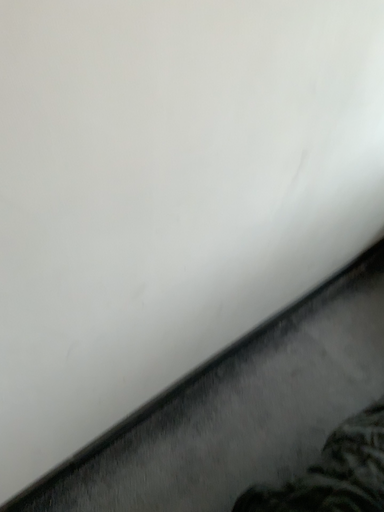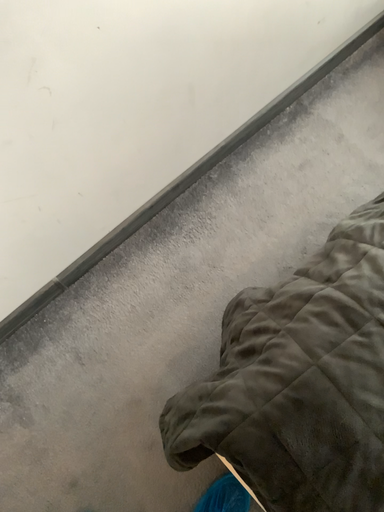
Question: Which way did the camera rotate in the video?

Choices:
 (A) rotated downward
 (B) rotated upward

Answer: (A)